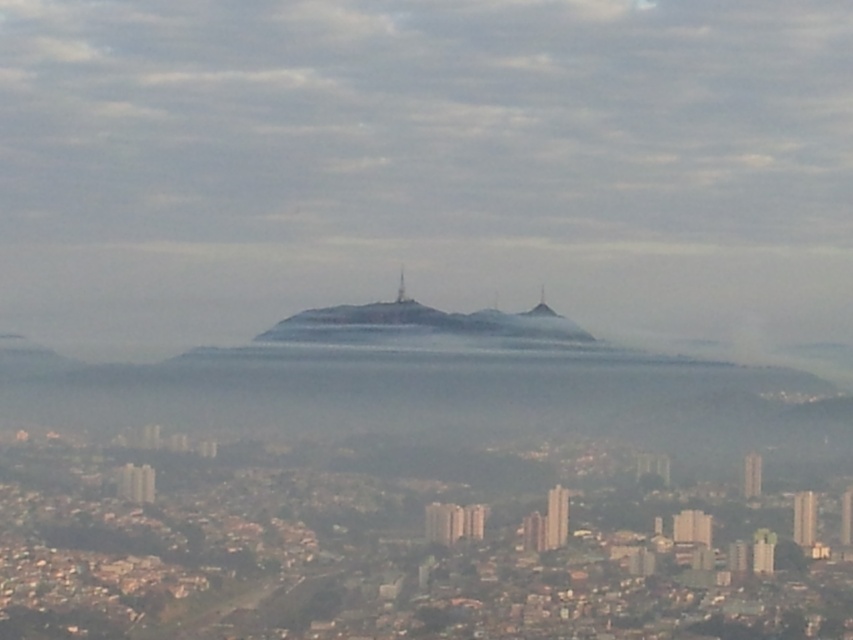
Question: Estimate the real-world distances between objects in this image. Which object is farther from the smooth stone peak at center?

Choices:
 (A) foggy gray mountain at center
 (B) foggy misty mountain at center

Answer: (B)

Question: Can you confirm if foggy misty mountain at center is wider than smooth stone peak at center?

Choices:
 (A) yes
 (B) no

Answer: (A)

Question: Is the position of foggy misty mountain at center more distant than that of foggy gray mountain at center?

Choices:
 (A) no
 (B) yes

Answer: (B)

Question: Which object appears farthest from the camera in this image?

Choices:
 (A) smooth stone peak at center
 (B) foggy misty mountain at center

Answer: (A)

Question: Estimate the real-world distances between objects in this image. Which object is closer to the foggy misty mountain at center?

Choices:
 (A) foggy gray mountain at center
 (B) smooth stone peak at center

Answer: (A)

Question: Is foggy misty mountain at center closer to the viewer compared to smooth stone peak at center?

Choices:
 (A) yes
 (B) no

Answer: (A)